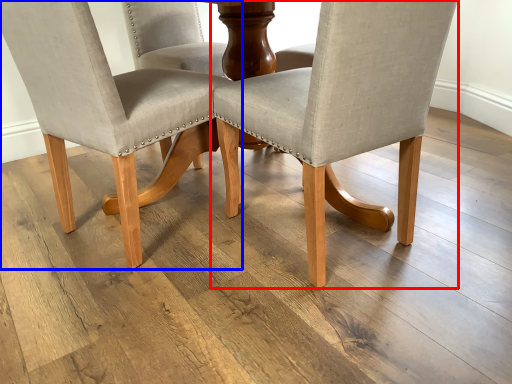
Question: Which object appears farthest to the camera in this image, chair (highlighted by a red box) or chair (highlighted by a blue box)?

Choices:
 (A) chair
 (B) chair

Answer: (B)